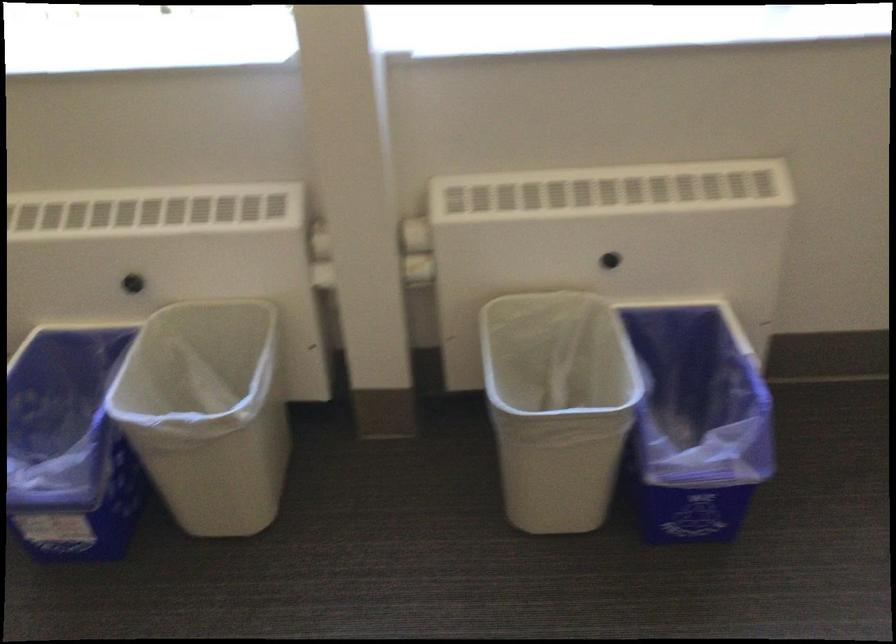
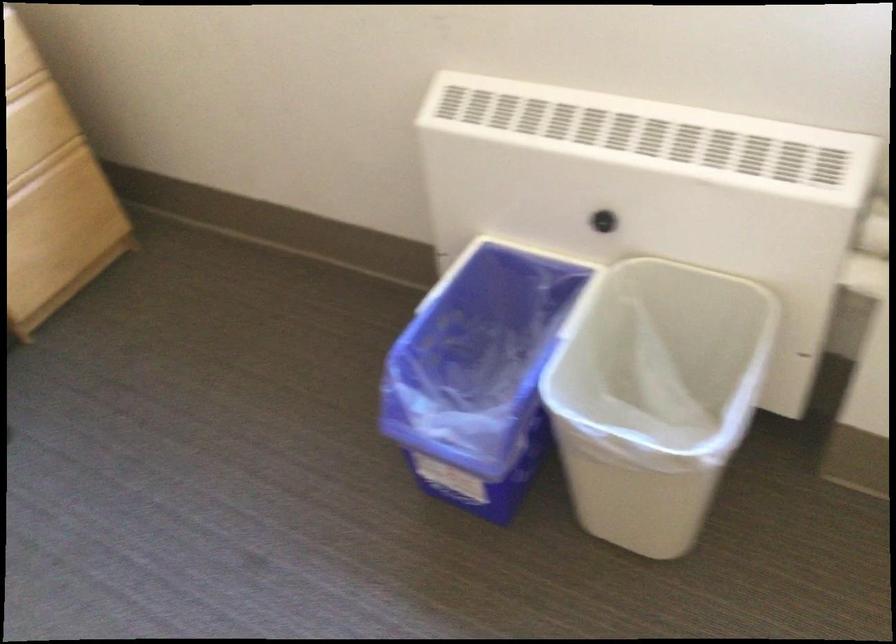
Question: The camera is either moving clockwise (left) or counter-clockwise (right) around the object. The first image is from the beginning of the video and the second image is from the end. Is the camera moving left or right when shooting the video?

Choices:
 (A) Left
 (B) Right

Answer: (B)